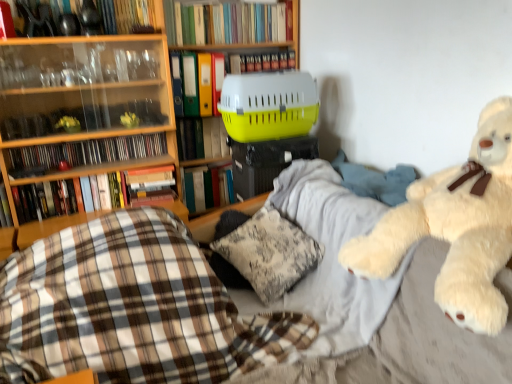
From a real-world perspective, locate any blank space above hardcover book at upper center, which appears as the 1th book when viewed from the top, in the image.

[(0.451, -0.001)]